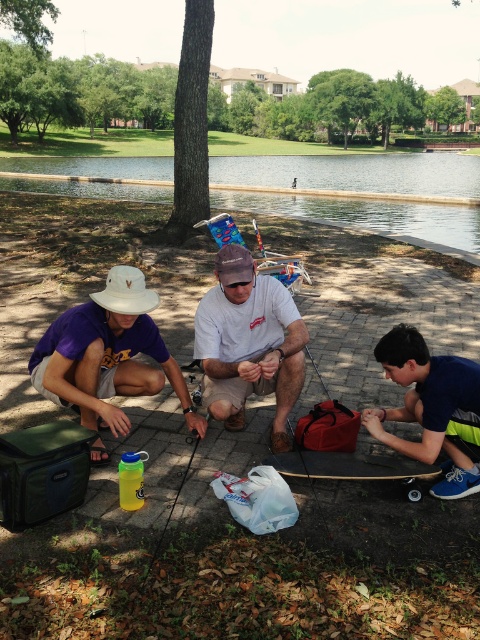
You are a photographer planning to take a group photo of the blue fabric shirt at lower right and the white matte cowboy hat at lower left. If you want to ensure both subjects appear proportionally balanced in the frame, which subject should you place closer to the camera?

The white matte cowboy hat at lower left should be placed closer to the camera because it is smaller than the blue fabric shirt at lower right, helping to balance their sizes in the photo.

You are a photographer standing at the edge of the pond and want to capture a photo of the blue fabric shirt at lower right and the white matte cowboy hat at lower left. Based on their positions, which object is closer to the water?

The blue fabric shirt at lower right is closer to the water because it is positioned below the white matte cowboy hat at lower left, indicating it is lower in the scene and thus nearer to the pond edge.

Based on the photo, you are planning to buy a hat for a costume party. You see two hats in the image, the white matte cowboy hat at lower left and the matte blue party hat at center. Which hat is larger in size?

The white matte cowboy hat at lower left is bigger than the matte blue party hat at center.